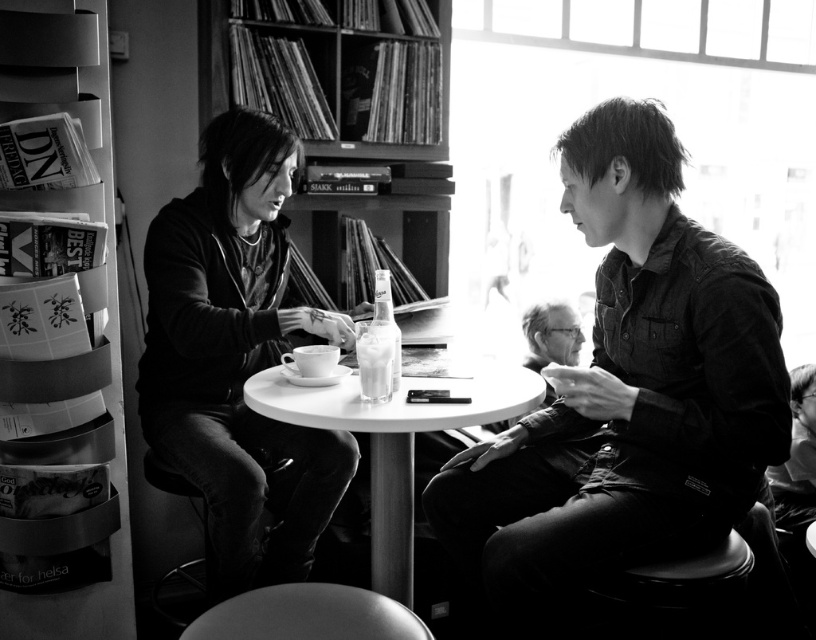
Who is more forward, (x=659, y=352) or (x=114, y=317)?

Point (x=659, y=352)

In the scene shown: Which is more to the left, denim jacket at right or metallic gray bookshelf at left?

metallic gray bookshelf at left

The image size is (816, 640). Identify the location of denim jacket at right. (624, 396).

You are a GUI agent. You are given a task and a screenshot of the screen. Output one action in this format:
    pyautogui.click(x=<x>, y=<y>)
    Task: Click on the denim jacket at right
    Image resolution: width=816 pixels, height=640 pixels.
    Given the screenshot: What is the action you would take?
    pyautogui.click(x=624, y=396)

Does wooden bookshelf at upper center appear on the right side of white glossy round table at center?

No, wooden bookshelf at upper center is not to the right of white glossy round table at center.

Does wooden bookshelf at upper center have a lesser height compared to white glossy round table at center?

No, wooden bookshelf at upper center is not shorter than white glossy round table at center.

The image size is (816, 640). What are the coordinates of `wooden bookshelf at upper center` in the screenshot? It's located at (380, 163).

Where is `wooden bookshelf at upper center`? The image size is (816, 640). wooden bookshelf at upper center is located at coordinates (380, 163).

Can you confirm if denim jacket at right is shorter than white glossy round table at center?

In fact, denim jacket at right may be taller than white glossy round table at center.

Is denim jacket at right smaller than white glossy round table at center?

Incorrect, denim jacket at right is not smaller in size than white glossy round table at center.

Is point (747, 264) behind point (435, 381)?

No, (747, 264) is in front of (435, 381).

What are the coordinates of `denim jacket at right` in the screenshot? It's located at pyautogui.click(x=624, y=396).